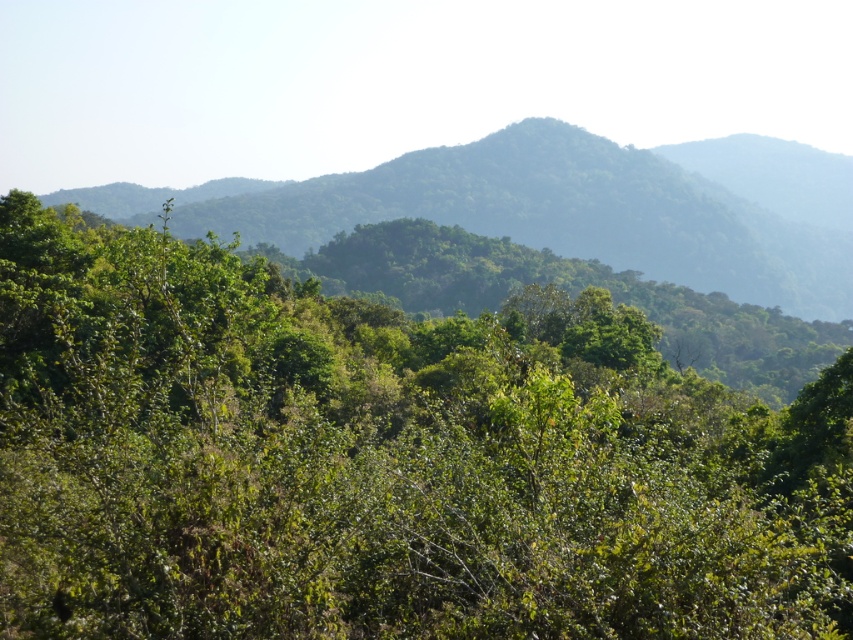
Question: Which point is farther to the camera?

Choices:
 (A) green leafy mountain at center
 (B) green leafy tree at center

Answer: (A)

Question: Does green leafy tree at center appear over green leafy mountain at center?

Choices:
 (A) yes
 (B) no

Answer: (B)

Question: Can you confirm if green leafy tree at center is positioned above green leafy mountain at center?

Choices:
 (A) no
 (B) yes

Answer: (A)

Question: Does green leafy tree at center have a lesser width compared to green leafy mountain at center?

Choices:
 (A) no
 (B) yes

Answer: (B)

Question: Which object appears farthest from the camera in this image?

Choices:
 (A) green leafy mountain at center
 (B) green leafy tree at center

Answer: (A)

Question: Which object appears closest to the camera in this image?

Choices:
 (A) green leafy tree at center
 (B) green leafy mountain at center

Answer: (A)